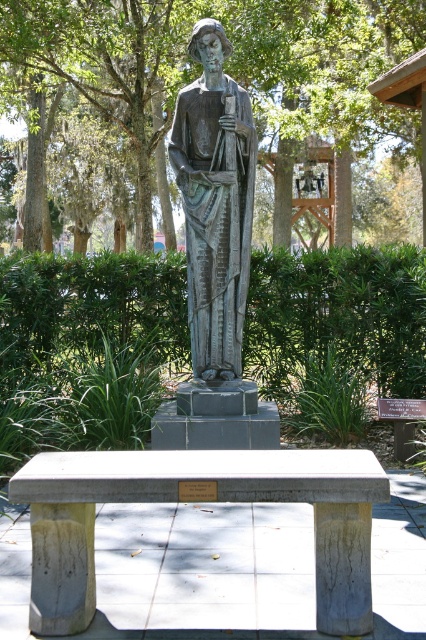
You are sitting on the gray concrete bench at center and want to look at the bronze statue at center. In which direction should you turn your head?

You should turn your head to the right to look at the bronze statue at center because the gray concrete bench at center is to the left of it.

You are standing at the entrance of the park and want to sit down on the gray concrete bench at center. According to the coordinates provided, is the bench located to your left or right side?

The gray concrete bench at center is located at coordinates point (198, 500), which places it to your right side from the entrance.